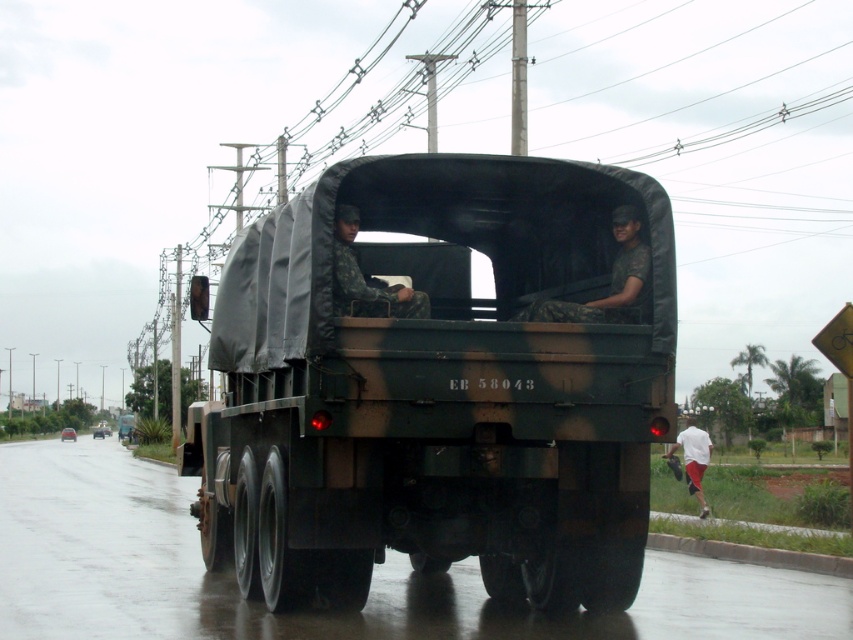
Does camouflage fabric uniform at rear have a lesser height compared to camouflage fabric uniform at center?

In fact, camouflage fabric uniform at rear may be taller than camouflage fabric uniform at center.

Does point (610, 289) lie in front of point (354, 209)?

No.

Who is more forward, (x=624, y=305) or (x=346, y=272)?

Point (x=346, y=272)

Find the location of a particular element. camouflage fabric uniform at rear is located at coordinates (610, 282).

Does point (432, 518) come in front of point (346, 230)?

No, it is not.

Based on the photo, does camouflage fabric truck at center come behind camouflage fabric uniform at center?

No, it is not.

At what (x,y) coordinates should I click in order to perform the action: click on camouflage fabric truck at center. Please return your answer as a coordinate pair (x, y). This screenshot has width=853, height=640. Looking at the image, I should click on (440, 381).

Which is more to the left, camouflage fabric uniform at rear or white cotton shirt at lower right?

From the viewer's perspective, camouflage fabric uniform at rear appears more on the left side.

Which of these two, camouflage fabric uniform at rear or white cotton shirt at lower right, stands shorter?

With less height is camouflage fabric uniform at rear.

Does point (614, 266) come in front of point (685, 458)?

Yes, point (614, 266) is closer to viewer.

The image size is (853, 640). What are the coordinates of `camouflage fabric uniform at rear` in the screenshot? It's located at (610, 282).